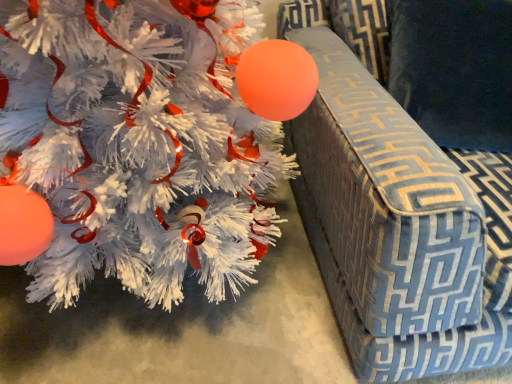
Identify the location of blue patterned fabric armchair at right. The image size is (512, 384). (412, 188).

In order to click on blue patterned fabric armchair at right in this screenshot , I will do `click(412, 188)`.

Which is more to the left, white matte christmas tree at left or blue patterned fabric armchair at right?

white matte christmas tree at left.

Would you say blue patterned fabric armchair at right is part of white matte christmas tree at left's contents?

No, white matte christmas tree at left does not contain blue patterned fabric armchair at right.

Is white matte christmas tree at left next to blue patterned fabric armchair at right and touching it?

No, white matte christmas tree at left is not making contact with blue patterned fabric armchair at right.

Which of these two, blue patterned fabric armchair at right or white matte christmas tree at left, is wider?

With larger width is blue patterned fabric armchair at right.

Can you confirm if blue patterned fabric armchair at right is shorter than white matte christmas tree at left?

No.

Between point (496, 10) and point (167, 115), which one is positioned in front?

The point (167, 115) is in front.

Is blue patterned fabric armchair at right turned away from white matte christmas tree at left?

No, blue patterned fabric armchair at right is not facing away from white matte christmas tree at left.

Which object is closer to the camera taking this photo, velvety blue pillow at upper right or white matte christmas tree at left?

Positioned in front is white matte christmas tree at left.

Is velvety blue pillow at upper right oriented away from white matte christmas tree at left?

No, velvety blue pillow at upper right's orientation is not away from white matte christmas tree at left.

From a real-world perspective, which object stands above the other?

velvety blue pillow at upper right is physically above.

Is velvety blue pillow at upper right to the left or to the right of white matte christmas tree at left in the image?

velvety blue pillow at upper right is positioned on white matte christmas tree at left's right side.

Which is less distant, (166, 164) or (478, 131)?

Point (166, 164)

At what (x,y) coordinates should I click in order to perform the action: click on pillow above the white matte christmas tree at left (from a real-world perspective). Please return your answer as a coordinate pair (x, y). The height and width of the screenshot is (384, 512). Looking at the image, I should click on (454, 69).

Can you confirm if white matte christmas tree at left is taller than velvety blue pillow at upper right?

Yes.

Based on their positions, is white matte christmas tree at left located to the left or right of velvety blue pillow at upper right?

Clearly, white matte christmas tree at left is on the left of velvety blue pillow at upper right in the image.

Which point is more distant from viewer, (x=471, y=328) or (x=408, y=15)?

The point (x=408, y=15) is more distant.

Is blue patterned fabric armchair at right located outside velvety blue pillow at upper right?

Yes, blue patterned fabric armchair at right is outside of velvety blue pillow at upper right.

From a real-world perspective, is blue patterned fabric armchair at right physically located above or below velvety blue pillow at upper right?

From a real-world perspective, blue patterned fabric armchair at right is physically below velvety blue pillow at upper right.

Is blue patterned fabric armchair at right to the right of velvety blue pillow at upper right from the viewer's perspective?

Yes.

Consider the image. Is velvety blue pillow at upper right positioned with its back to blue patterned fabric armchair at right?

Yes, blue patterned fabric armchair at right is at the back of velvety blue pillow at upper right.

Measure the distance from velvety blue pillow at upper right to blue patterned fabric armchair at right.

5.61 inches.

From a real-world perspective, does velvety blue pillow at upper right sit lower than blue patterned fabric armchair at right?

No, from a real-world perspective, velvety blue pillow at upper right is not below blue patterned fabric armchair at right.

Consider the image. How different are the orientations of velvety blue pillow at upper right and blue patterned fabric armchair at right in degrees?

The angular difference between velvety blue pillow at upper right and blue patterned fabric armchair at right is 0.000189 degrees.

Locate an element on the screen. The width and height of the screenshot is (512, 384). armchair located above the white matte christmas tree at left (from the image's perspective) is located at coordinates (412, 188).

Locate an element on the screen. Image resolution: width=512 pixels, height=384 pixels. christmas tree below the blue patterned fabric armchair at right (from the image's perspective) is located at coordinates (142, 141).

Based on their spatial positions, is velvety blue pillow at upper right or white matte christmas tree at left further from blue patterned fabric armchair at right?

Based on the image, white matte christmas tree at left appears to be further to blue patterned fabric armchair at right.

Considering their positions, is blue patterned fabric armchair at right positioned further to velvety blue pillow at upper right than white matte christmas tree at left?

The object further to velvety blue pillow at upper right is white matte christmas tree at left.

Based on their spatial positions, is white matte christmas tree at left or blue patterned fabric armchair at right closer to velvety blue pillow at upper right?

blue patterned fabric armchair at right is positioned closer to the anchor velvety blue pillow at upper right.

Looking at the image, which one is located closer to white matte christmas tree at left, blue patterned fabric armchair at right or velvety blue pillow at upper right?

Among the two, blue patterned fabric armchair at right is located nearer to white matte christmas tree at left.

Which object lies further to the anchor point blue patterned fabric armchair at right, white matte christmas tree at left or velvety blue pillow at upper right?

white matte christmas tree at left is further to blue patterned fabric armchair at right.

Which object lies further to the anchor point white matte christmas tree at left, velvety blue pillow at upper right or blue patterned fabric armchair at right?

velvety blue pillow at upper right.

Find the location of a particular element. Image resolution: width=512 pixels, height=384 pixels. pillow located between white matte christmas tree at left and blue patterned fabric armchair at right in the left-right direction is located at coordinates (454, 69).